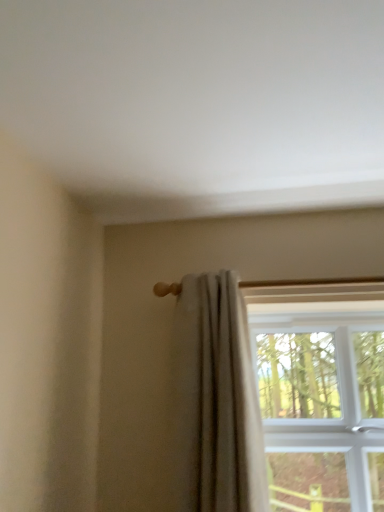
Question: From the image's perspective, is clear glass window at upper right above or below light beige fabric curtain at center?

Choices:
 (A) above
 (B) below

Answer: (B)

Question: Does point (296, 413) appear closer or farther from the camera than point (238, 394)?

Choices:
 (A) farther
 (B) closer

Answer: (A)

Question: From a real-world perspective, is clear glass window at upper right positioned above or below light beige fabric curtain at center?

Choices:
 (A) below
 (B) above

Answer: (A)

Question: Is light beige fabric curtain at center inside the boundaries of clear glass window at upper right, or outside?

Choices:
 (A) inside
 (B) outside

Answer: (B)

Question: Is light beige fabric curtain at center in front of or behind clear glass window at upper right in the image?

Choices:
 (A) front
 (B) behind

Answer: (A)

Question: From the image's perspective, is light beige fabric curtain at center above or below clear glass window at upper right?

Choices:
 (A) below
 (B) above

Answer: (B)

Question: From a real-world perspective, is light beige fabric curtain at center above or below clear glass window at upper right?

Choices:
 (A) below
 (B) above

Answer: (B)